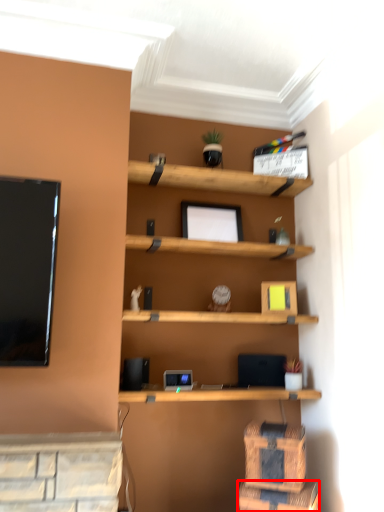
Question: From the image's perspective, where is drawer (annotated by the red box) located in relation to drawer in the image?

Choices:
 (A) below
 (B) above

Answer: (A)